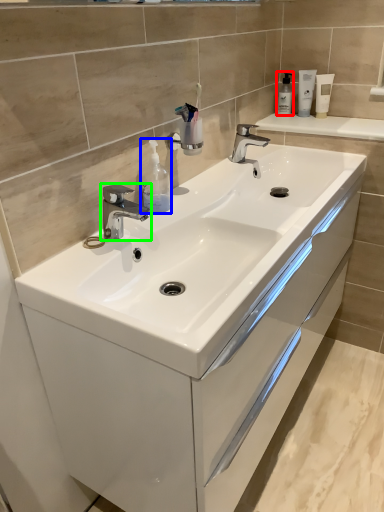
Question: Estimate the real-world distances between objects in this image. Which object is farther from soap dispenser (highlighted by a red box), soap dispenser (highlighted by a blue box) or tap (highlighted by a green box)?

Choices:
 (A) soap dispenser
 (B) tap

Answer: (B)